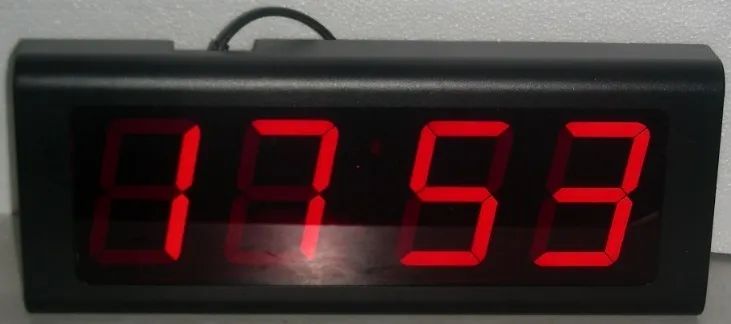
Where is `table`? The image size is (731, 324). table is located at coordinates (719, 279).